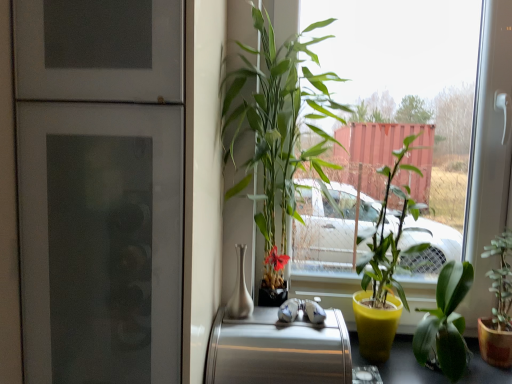
I want to click on yellow matte pot at center, positioned as the second houseplant in left-to-right order, so click(384, 269).

Measure the distance between point [443,228] and camera.

They are 3.94 feet apart.

The height and width of the screenshot is (384, 512). I want to click on green glossy plant at center, positioned as the 1th houseplant in left-to-right order, so click(x=277, y=130).

What do you see at coordinates (498, 306) in the screenshot?
I see `green matte plant at lower right, which is the first houseplant in right-to-left order` at bounding box center [498, 306].

This screenshot has height=384, width=512. What do you see at coordinates (278, 350) in the screenshot? I see `brushed metal toaster at center` at bounding box center [278, 350].

Where is `yellow matte pot at center, positioned as the second houseplant in left-to-right order`? This screenshot has width=512, height=384. yellow matte pot at center, positioned as the second houseplant in left-to-right order is located at coordinates (384, 269).

Is matte glass refrigerator at left smaller than green leafy plant at center?

Indeed, matte glass refrigerator at left has a smaller size compared to green leafy plant at center.

From the picture: Is matte glass refrigerator at left positioned behind green leafy plant at center?

No, it is not.

Identify the location of fridge below the green leafy plant at center (from a real-world perspective). (100, 188).

From the image's perspective, which is above, matte glass refrigerator at left or green leafy plant at center?

green leafy plant at center appears higher in the image.

Is brushed metal toaster at center at the left side of matte glass refrigerator at left?

In fact, brushed metal toaster at center is to the right of matte glass refrigerator at left.

Is brushed metal toaster at center taller or shorter than matte glass refrigerator at left?

Clearly, brushed metal toaster at center is shorter compared to matte glass refrigerator at left.

Locate an element on the screen. The width and height of the screenshot is (512, 384). appliance behind the matte glass refrigerator at left is located at coordinates (278, 350).

From a real-world perspective, is brushed metal toaster at center beneath matte glass refrigerator at left?

Correct, in the physical world, brushed metal toaster at center is lower than matte glass refrigerator at left.

Which of these two, smooth black table at lower right or yellow matte pot at center, acting as the third houseplant starting from the right, is bigger?

yellow matte pot at center, acting as the third houseplant starting from the right, is bigger.

From the image's perspective, does smooth black table at lower right appear lower than yellow matte pot at center, acting as the third houseplant starting from the right?

Indeed, from the image's perspective, smooth black table at lower right is shown beneath yellow matte pot at center, acting as the third houseplant starting from the right.

How many degrees apart are the facing directions of smooth black table at lower right and yellow matte pot at center, acting as the third houseplant starting from the right?

The facing directions of smooth black table at lower right and yellow matte pot at center, acting as the third houseplant starting from the right, are 0.443 degrees apart.

Considering the relative positions of smooth black table at lower right and yellow matte pot at center, acting as the third houseplant starting from the right, in the image provided, is smooth black table at lower right behind yellow matte pot at center, acting as the third houseplant starting from the right,?

Yes, smooth black table at lower right is further from the viewer.

From a real-world perspective, is smooth black table at lower right located higher than satin silver vase at center?

No, from a real-world perspective, smooth black table at lower right is not over satin silver vase at center

Does smooth black table at lower right appear on the right side of satin silver vase at center?

Yes, smooth black table at lower right is to the right of satin silver vase at center.

Is point (382, 366) in front of point (241, 276)?

That is False.

Looking at this image, would you say smooth black table at lower right contains satin silver vase at center?

No, smooth black table at lower right does not contain satin silver vase at center.

In the scene shown: From a real-world perspective, is green glossy leafy plant at lower right, the 3th houseplant when ordered from left to right, located beneath yellow matte pot at center, acting as the third houseplant starting from the right?

Yes, from a real-world perspective, green glossy leafy plant at lower right, the 3th houseplant when ordered from left to right, is under yellow matte pot at center, acting as the third houseplant starting from the right.

Between green glossy leafy plant at lower right, marked as the second houseplant in a right-to-left arrangement, and yellow matte pot at center, acting as the third houseplant starting from the right, which one is positioned in front?

green glossy leafy plant at lower right, marked as the second houseplant in a right-to-left arrangement, is more forward.

From the image's perspective, which one is positioned higher, green glossy leafy plant at lower right, marked as the second houseplant in a right-to-left arrangement, or yellow matte pot at center, acting as the third houseplant starting from the right?

yellow matte pot at center, acting as the third houseplant starting from the right, is shown above in the image.

From their relative heights in the image, would you say green glossy leafy plant at lower right, marked as the second houseplant in a right-to-left arrangement, is taller or shorter than yellow matte pot at center, positioned as the second houseplant in left-to-right order?

In the image, green glossy leafy plant at lower right, marked as the second houseplant in a right-to-left arrangement, appears to be shorter than yellow matte pot at center, positioned as the second houseplant in left-to-right order.

Looking at this image, choose the correct answer: Is green glossy plant at center, positioned as the 1th houseplant in left-to-right order, inside smooth black table at lower right or outside it?

green glossy plant at center, positioned as the 1th houseplant in left-to-right order, is located beyond the bounds of smooth black table at lower right.

Is the depth of green glossy plant at center, the fourth houseplant from the right, less than that of smooth black table at lower right?

Yes, it is.

How much distance is there between green glossy plant at center, positioned as the 1th houseplant in left-to-right order, and smooth black table at lower right?

green glossy plant at center, positioned as the 1th houseplant in left-to-right order, is 23.73 inches away from smooth black table at lower right.

From the image's perspective, which one is positioned lower, green glossy plant at center, the fourth houseplant from the right, or smooth black table at lower right?

smooth black table at lower right is shown below in the image.

Measure the distance from green glossy plant at center, the fourth houseplant from the right, to matte glass refrigerator at left.

The distance of green glossy plant at center, the fourth houseplant from the right, from matte glass refrigerator at left is 18.67 inches.

Could you tell me if green glossy plant at center, positioned as the 1th houseplant in left-to-right order, is facing matte glass refrigerator at left?

No.

Considering the sizes of objects green glossy plant at center, the fourth houseplant from the right, and matte glass refrigerator at left in the image provided, who is smaller, green glossy plant at center, the fourth houseplant from the right, or matte glass refrigerator at left?

green glossy plant at center, the fourth houseplant from the right.

The width and height of the screenshot is (512, 384). I want to click on window that appears on the right of matte glass refrigerator at left, so click(x=490, y=154).

Identify the location of fridge located above the brushed metal toaster at center (from the image's perspective). (100, 188).

From the image, which object appears to be farther from green glossy leafy plant at lower right, marked as the second houseplant in a right-to-left arrangement, satin silver vase at center or brushed metal toaster at center?

satin silver vase at center.

Estimate the real-world distances between objects in this image. Which object is closer to matte glass refrigerator at left, satin silver vase at center or green glossy leafy plant at lower right, the 3th houseplant when ordered from left to right?

Based on the image, satin silver vase at center appears to be nearer to matte glass refrigerator at left.

Which object lies nearer to the anchor point yellow matte pot at center, acting as the third houseplant starting from the right, smooth black table at lower right or satin silver vase at center?

smooth black table at lower right.

Considering their positions, is green glossy leafy plant at lower right, marked as the second houseplant in a right-to-left arrangement, positioned closer to smooth black table at lower right than satin silver vase at center?

green glossy leafy plant at lower right, marked as the second houseplant in a right-to-left arrangement, is positioned closer to the anchor smooth black table at lower right.

From the image, which object appears to be farther from brushed metal toaster at center, satin silver vase at center or matte glass refrigerator at left?

matte glass refrigerator at left.

Which object lies further to the anchor point satin silver vase at center, green leafy plant at center or smooth black table at lower right?

Among the two, smooth black table at lower right is located further to satin silver vase at center.

Considering their positions, is yellow matte pot at center, positioned as the second houseplant in left-to-right order, positioned further to satin silver vase at center than smooth black table at lower right?

smooth black table at lower right lies further to satin silver vase at center than the other object.

From the picture: Estimate the real-world distances between objects in this image. Which object is closer to satin silver vase at center, yellow matte pot at center, acting as the third houseplant starting from the right, or green leafy plant at center?

Based on the image, yellow matte pot at center, acting as the third houseplant starting from the right, appears to be nearer to satin silver vase at center.

The width and height of the screenshot is (512, 384). Identify the location of window between matte glass refrigerator at left and green matte plant at lower right, acting as the fourth houseplant starting from the left. (490, 154).

Locate an element on the screen. This screenshot has width=512, height=384. window between yellow matte pot at center, positioned as the second houseplant in left-to-right order, and green matte plant at lower right, acting as the fourth houseplant starting from the left, in the horizontal direction is located at coordinates (490, 154).

The image size is (512, 384). What are the coordinates of `appliance located between satin silver vase at center and yellow matte pot at center, acting as the third houseplant starting from the right, in the left-right direction` in the screenshot? It's located at (278, 350).

At what (x,y) coordinates should I click in order to perform the action: click on appliance between matte glass refrigerator at left and smooth black table at lower right in the horizontal direction. Please return your answer as a coordinate pair (x, y). Image resolution: width=512 pixels, height=384 pixels. Looking at the image, I should click on (278, 350).